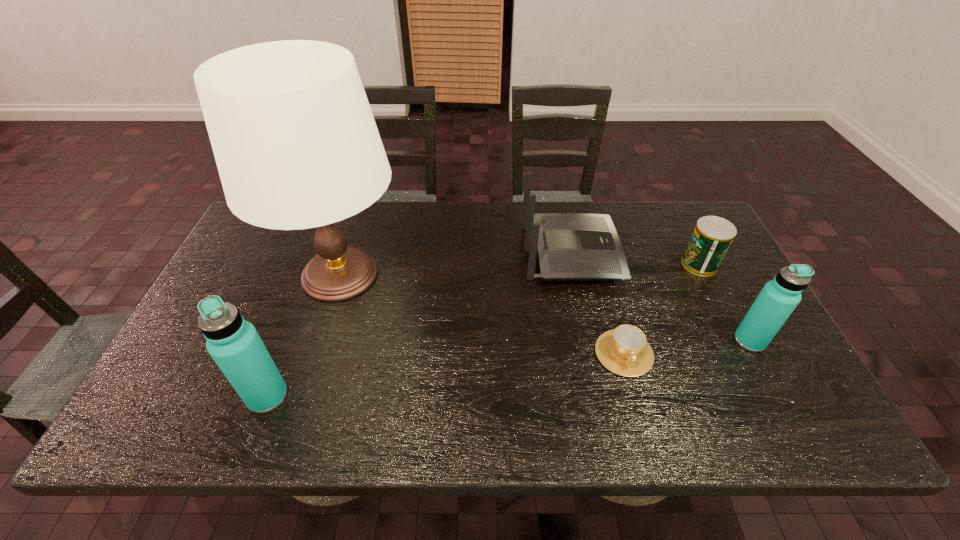
Find the location of a particular element. This screenshot has width=960, height=540. the taller water bottle is located at coordinates (234, 344).

This screenshot has width=960, height=540. What are the coordinates of `the left water bottle` in the screenshot? It's located at (234, 344).

The image size is (960, 540). Find the location of `the farther water bottle`. the farther water bottle is located at coordinates (779, 297).

What are the coordinates of `the third tallest object` in the screenshot? It's located at (779, 297).

This screenshot has width=960, height=540. In order to click on the fourth tallest object in this screenshot , I will do click(571, 246).

You are a GUI agent. You are given a task and a screenshot of the screen. Output one action in this format:
    pyautogui.click(x=<x>, y=<y>)
    Task: Click on the lamp
    
    Given the screenshot: What is the action you would take?
    pyautogui.click(x=296, y=145)

Where is `can`? This screenshot has width=960, height=540. can is located at coordinates (712, 236).

Locate an element on the screen. The height and width of the screenshot is (540, 960). the shortest object is located at coordinates (624, 351).

Where is `vacant region located on the left of the nearer water bottle`? The width and height of the screenshot is (960, 540). vacant region located on the left of the nearer water bottle is located at coordinates (163, 396).

This screenshot has width=960, height=540. I want to click on free spot located on the left of the shorter water bottle, so click(x=699, y=341).